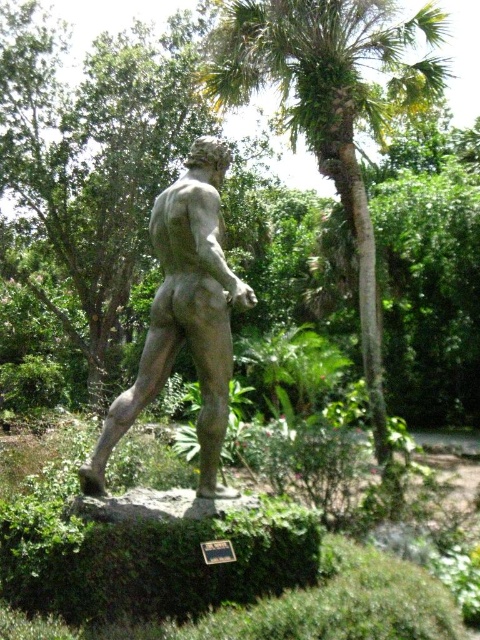
Can you confirm if green leafy palm tree at center is shorter than stone statue at center?

Yes.

Where is `green leafy palm tree at center`? The width and height of the screenshot is (480, 640). green leafy palm tree at center is located at coordinates (x=333, y=108).

Image resolution: width=480 pixels, height=640 pixels. I want to click on green leafy palm tree at center, so click(333, 108).